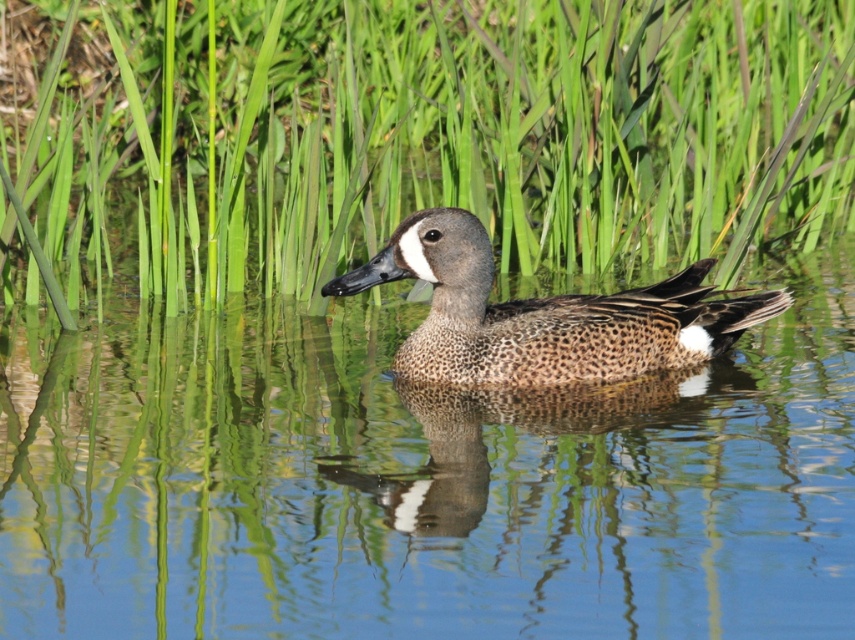
You are a photographer trying to capture the speckled feathered duck at center in the image. The green grass at center is blocking your view. Can you determine if the duck will be visible through the grass?

The green grass at center is much taller than the speckled feathered duck at center, so the duck might be partially or fully hidden by the grass, making it less visible.

You are a photographer trying to capture a closeup of the speckled feathered duck at center while standing on the green grass at center. Can you reach the duck without moving from your current position?

The green grass at center and the speckled feathered duck at center are 6.95 feet apart from each other. Since the distance is more than an average person can reach, you cannot capture the closeup without moving closer.

You are a photographer trying to capture the Blue Winged Teal duck in the image. You want to place your subject at the golden ratio point to make the composition more appealing. The golden ratio point is at point (413, 138). Is the duck positioned at this point?

The green grass at center is located at point (413, 138), which is the golden ratio point. The duck is swimming on the water, so it is not positioned at the golden ratio point.